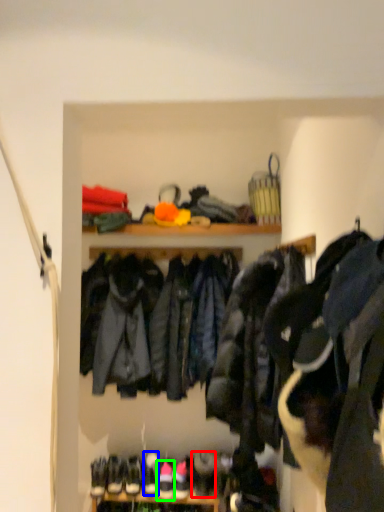
Question: Based on their relative distances, which object is farther from shoe (highlighted by a red box)? Choose from footwear (highlighted by a blue box) and footwear (highlighted by a green box).

Choices:
 (A) footwear
 (B) footwear

Answer: (A)